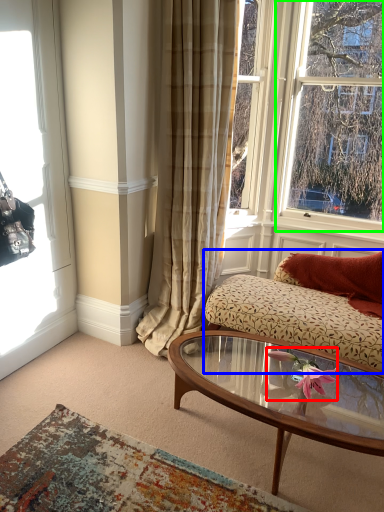
Question: Which is nearer to the flower (highlighted by a red box)? studio couch (highlighted by a blue box) or window (highlighted by a green box).

Choices:
 (A) studio couch
 (B) window

Answer: (A)